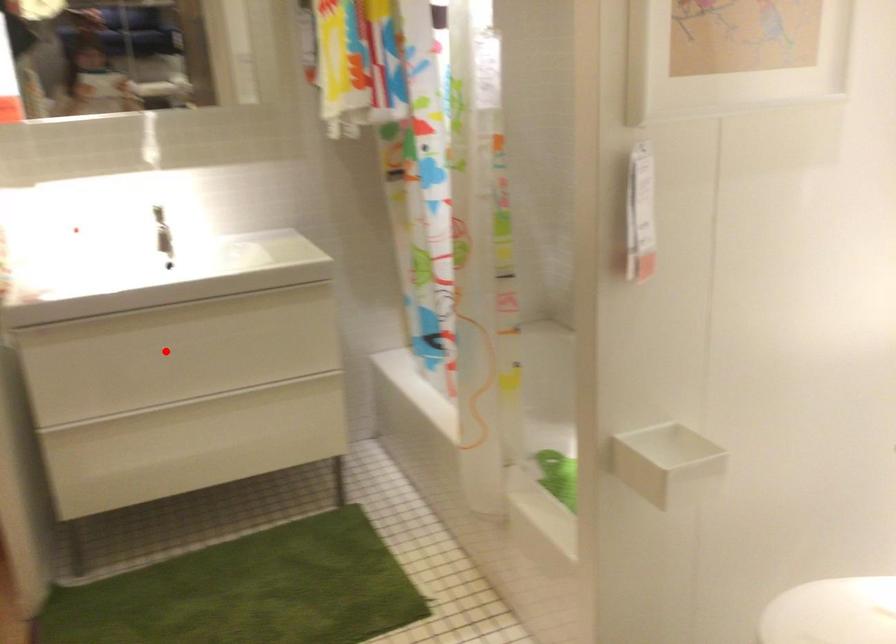
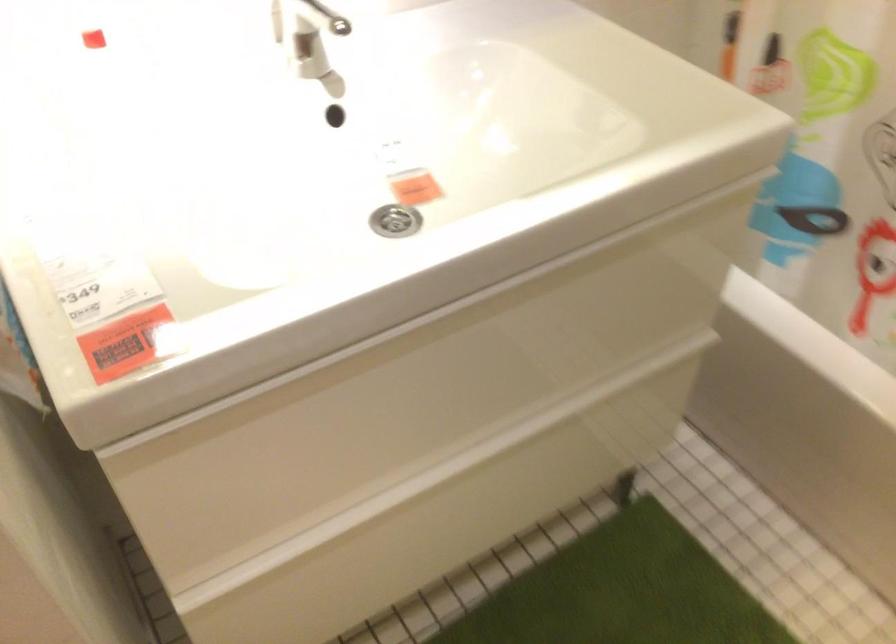
In the second image, find the point that corresponds to the highlighted location in the first image.

(423, 392)